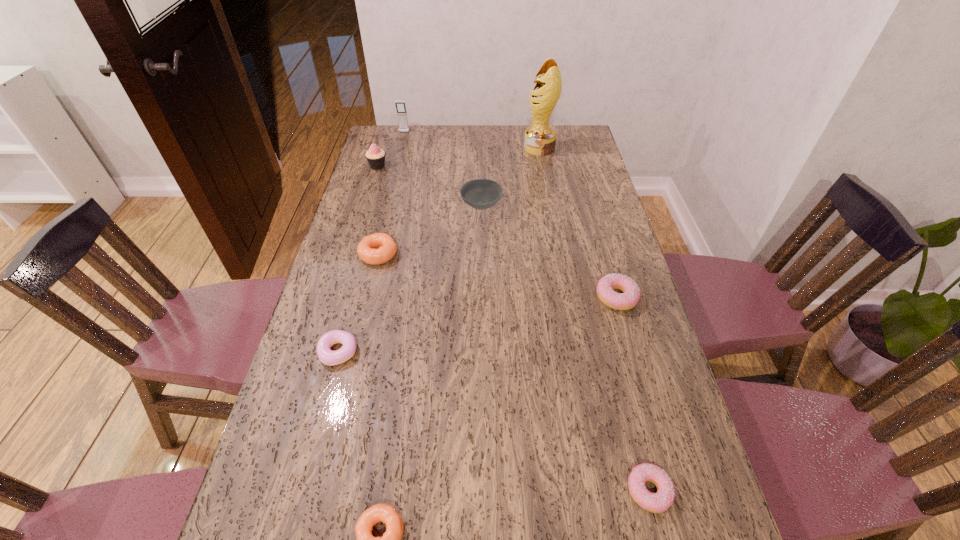
Locate an element on the screen. Image resolution: width=960 pixels, height=540 pixels. doughnut object that ranks as the third closest to the third nearest object is located at coordinates (629, 298).

Image resolution: width=960 pixels, height=540 pixels. In order to click on vacant area in the image that satisfies the following two spatial constraints: 1. on the front-facing side of the smaller pink doughnut; 2. on the left side of the cellular telephone in this screenshot , I will do `click(317, 490)`.

Find the location of `free location that satisfies the following two spatial constraints: 1. on the front side of the purple doughnut; 2. on the left side of the nearer pink doughnut`. free location that satisfies the following two spatial constraints: 1. on the front side of the purple doughnut; 2. on the left side of the nearer pink doughnut is located at coordinates (301, 490).

Where is `free space in the image that satisfies the following two spatial constraints: 1. on the back side of the fourth nearest object; 2. on the front-facing side of the eighth nearest object`? free space in the image that satisfies the following two spatial constraints: 1. on the back side of the fourth nearest object; 2. on the front-facing side of the eighth nearest object is located at coordinates (573, 147).

You are a GUI agent. You are given a task and a screenshot of the screen. Output one action in this format:
    pyautogui.click(x=<x>, y=<y>)
    Task: Click on the vacant space that satisfies the following two spatial constraints: 1. on the front-facing side of the brown bowl; 2. on the left side of the gray cellular telephone
    This screenshot has width=960, height=540.
    Given the screenshot: What is the action you would take?
    point(386,206)

Where is `free location that satisfies the following two spatial constraints: 1. on the front-facing side of the farthest doughnut; 2. on the left side of the farthest object`? free location that satisfies the following two spatial constraints: 1. on the front-facing side of the farthest doughnut; 2. on the left side of the farthest object is located at coordinates (374, 254).

This screenshot has width=960, height=540. In order to click on free space that satisfies the following two spatial constraints: 1. on the front-facing side of the gold award; 2. on the front side of the sixth object from left to right in this screenshot , I will do click(x=550, y=206).